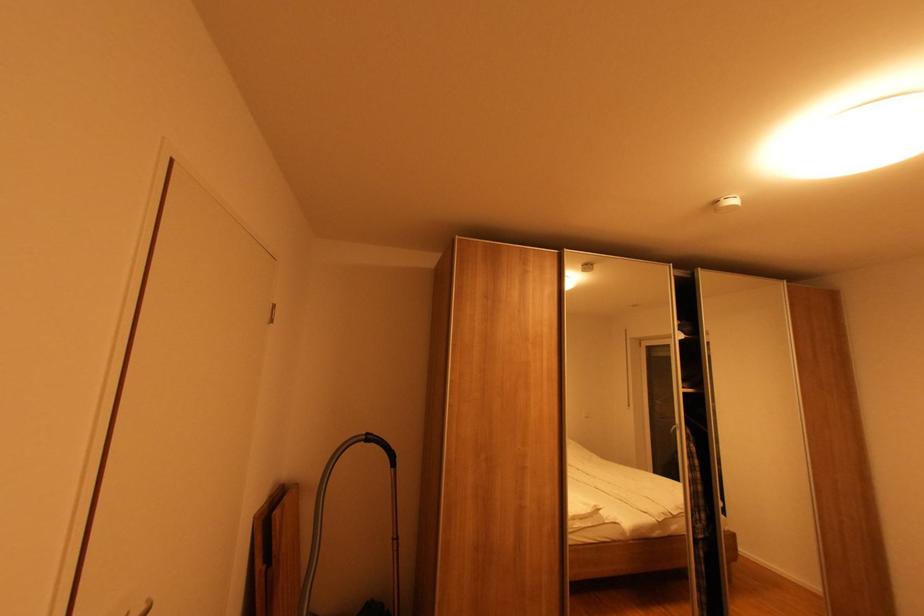
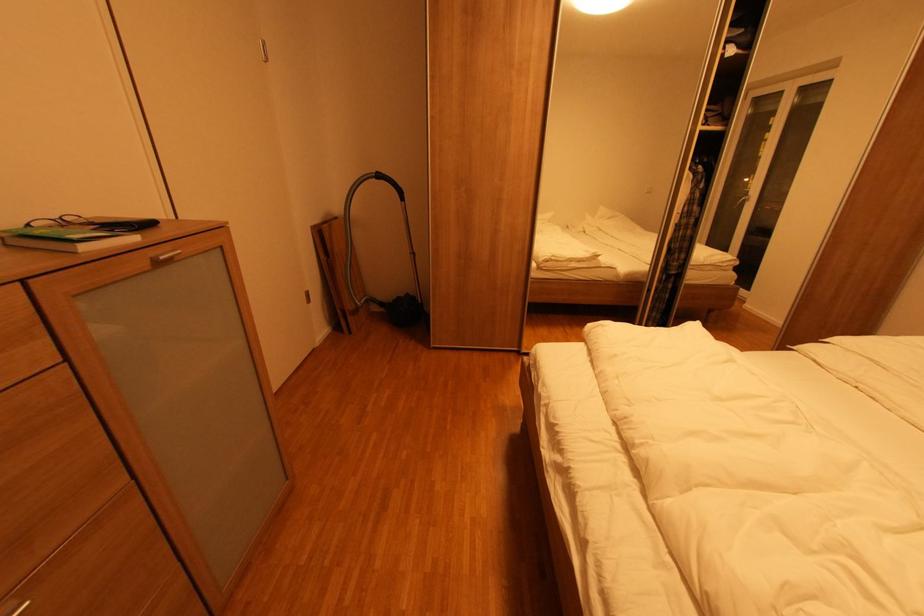
Locate, in the second image, the point that corresponds to (379,445) in the first image.

(387, 182)